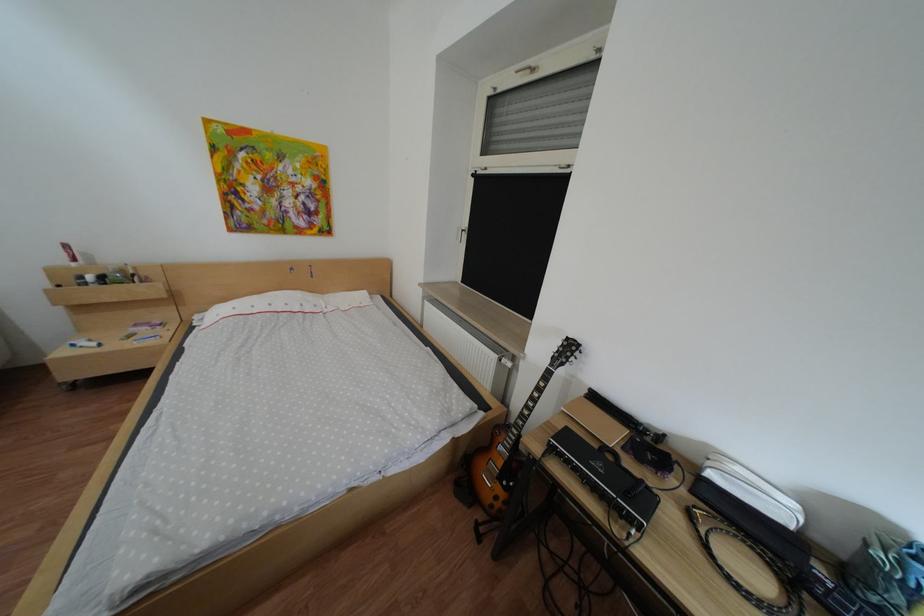
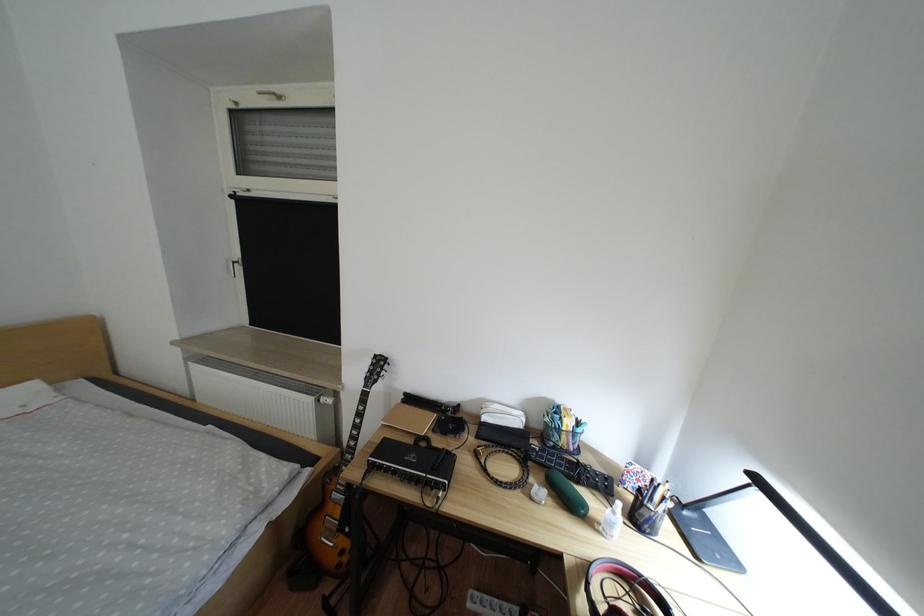
Locate, in the second image, the point that corresponds to point (727, 476) in the first image.

(501, 419)